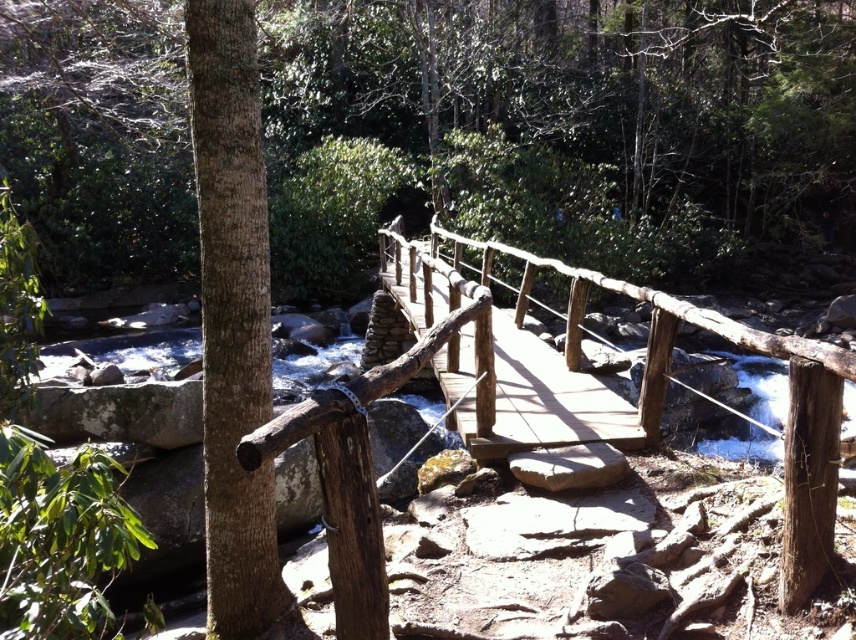
Question: Which point appears farthest from the camera in this image?

Choices:
 (A) (831, 516)
 (B) (614, 428)

Answer: (B)

Question: Does smooth brown tree trunk at left lie in front of brown rough wooden post at lower right?

Choices:
 (A) yes
 (B) no

Answer: (A)

Question: Which object is closer to the camera taking this photo?

Choices:
 (A) smooth brown tree trunk at left
 (B) brown rough wooden post at lower right

Answer: (A)

Question: Can you confirm if smooth brown tree trunk at left is bigger than brown rough wooden post at lower right?

Choices:
 (A) yes
 (B) no

Answer: (A)

Question: Is natural wood bridge at center below brown rough wooden post at lower right?

Choices:
 (A) yes
 (B) no

Answer: (B)

Question: Which of the following is the farthest from the observer?

Choices:
 (A) natural wood bridge at center
 (B) brown rough wooden post at lower right

Answer: (B)